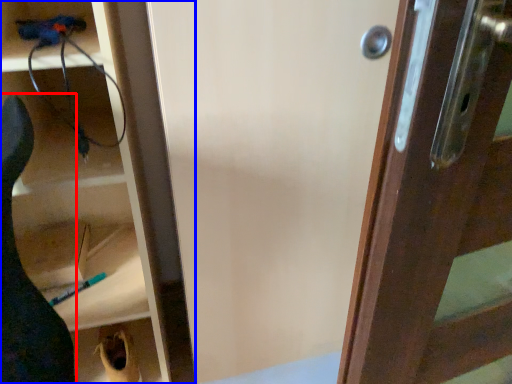
Question: Among these objects, which one is farthest to the camera, animal (highlighted by a red box) or cabinetry (highlighted by a blue box)?

Choices:
 (A) animal
 (B) cabinetry

Answer: (B)